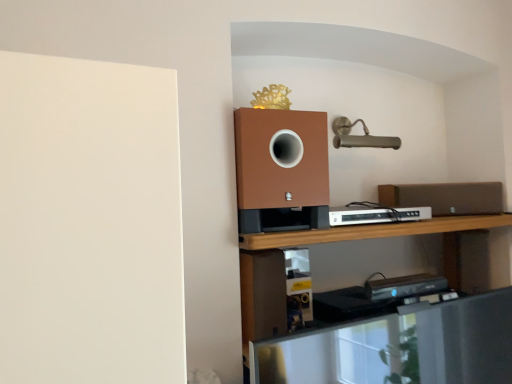
Question: Is metallic silver shelf at lower center oriented towards brown matte speaker at right?

Choices:
 (A) no
 (B) yes

Answer: (A)

Question: Considering the relative sizes of metallic silver shelf at lower center and brown matte speaker at right in the image provided, is metallic silver shelf at lower center smaller than brown matte speaker at right?

Choices:
 (A) yes
 (B) no

Answer: (B)

Question: Is the position of metallic silver shelf at lower center less distant than that of brown matte speaker at right?

Choices:
 (A) no
 (B) yes

Answer: (B)

Question: Is metallic silver shelf at lower center taller than brown matte speaker at right?

Choices:
 (A) no
 (B) yes

Answer: (B)

Question: Is metallic silver shelf at lower center to the right of brown matte speaker at right from the viewer's perspective?

Choices:
 (A) no
 (B) yes

Answer: (A)

Question: Is white plastic dvd player at center in front of or behind brown matte speaker at right in the image?

Choices:
 (A) behind
 (B) front

Answer: (B)

Question: Considering the positions of white plastic dvd player at center and brown matte speaker at right in the image, is white plastic dvd player at center taller or shorter than brown matte speaker at right?

Choices:
 (A) tall
 (B) short

Answer: (B)

Question: Is white plastic dvd player at center spatially inside brown matte speaker at right, or outside of it?

Choices:
 (A) outside
 (B) inside

Answer: (A)

Question: In the image, is white plastic dvd player at center on the left side or the right side of brown matte speaker at right?

Choices:
 (A) left
 (B) right

Answer: (A)

Question: Visually, is white plastic dvd player at center positioned to the left or to the right of metallic silver shelf at lower center?

Choices:
 (A) left
 (B) right

Answer: (A)

Question: Do you think white plastic dvd player at center is within metallic silver shelf at lower center, or outside of it?

Choices:
 (A) inside
 (B) outside

Answer: (B)

Question: From a real-world perspective, is white plastic dvd player at center positioned above or below metallic silver shelf at lower center?

Choices:
 (A) below
 (B) above

Answer: (B)

Question: Is white plastic dvd player at center taller or shorter than metallic silver shelf at lower center?

Choices:
 (A) tall
 (B) short

Answer: (B)

Question: Considering the positions of brown matte speaker at right and white plastic dvd player at center in the image, is brown matte speaker at right taller or shorter than white plastic dvd player at center?

Choices:
 (A) short
 (B) tall

Answer: (B)

Question: Relative to white plastic dvd player at center, is brown matte speaker at right in front or behind?

Choices:
 (A) behind
 (B) front

Answer: (A)